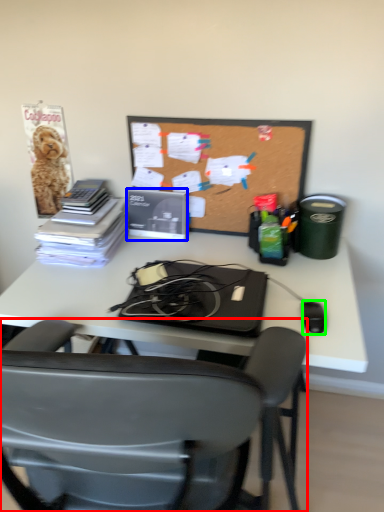
Question: Which object is positioned closest to chair (highlighted by a red box)? Select from paperback book (highlighted by a blue box) and mouse (highlighted by a green box).

Choices:
 (A) paperback book
 (B) mouse

Answer: (B)